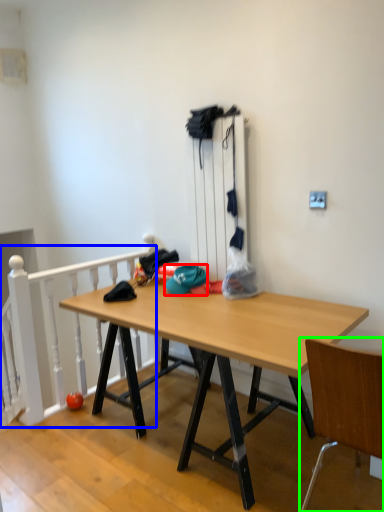
Question: Considering the real-world distances, which object is farthest from hat (highlighted by a red box)? rail (highlighted by a blue box) or chair (highlighted by a green box)?

Choices:
 (A) rail
 (B) chair

Answer: (B)